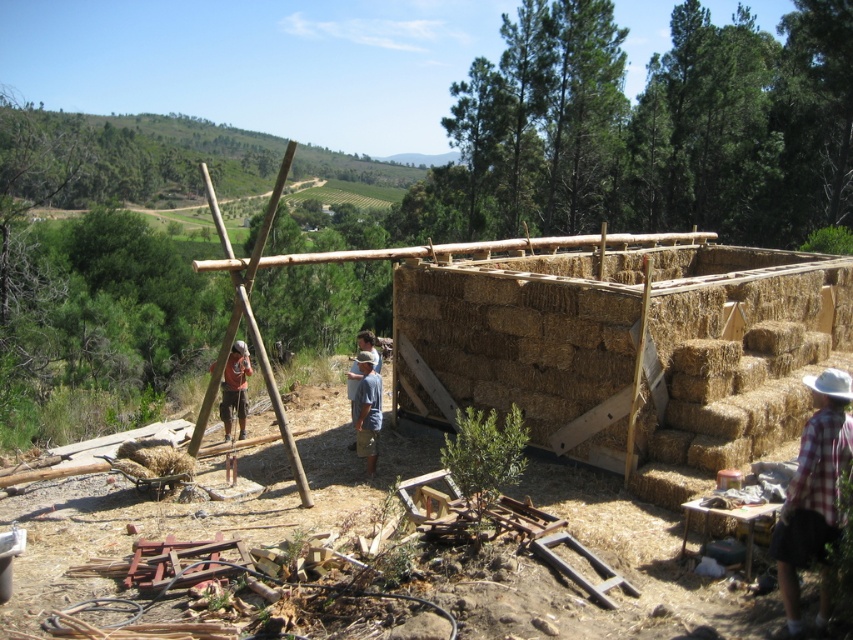
You are standing at the construction site and want to know which of the two points, point (364, 444) or point (227, 360), is closer to you. Can you determine this based on the scene?

Point (364, 444) is closer to the viewer than point 0.567, 0.267, so yes, you can determine that point (364, 444) is closer to you.

Where is the blue denim jeans at center located in the image?

The blue denim jeans at center is located at point (367, 410) in the image.

You are a worker at the construction site and need to determine which clothing item has a greater width between the plaid fabric shirt at lower right and the blue denim jeans at center. Which one is wider?

The plaid fabric shirt at lower right is wider than the blue denim jeans at center according to the description.